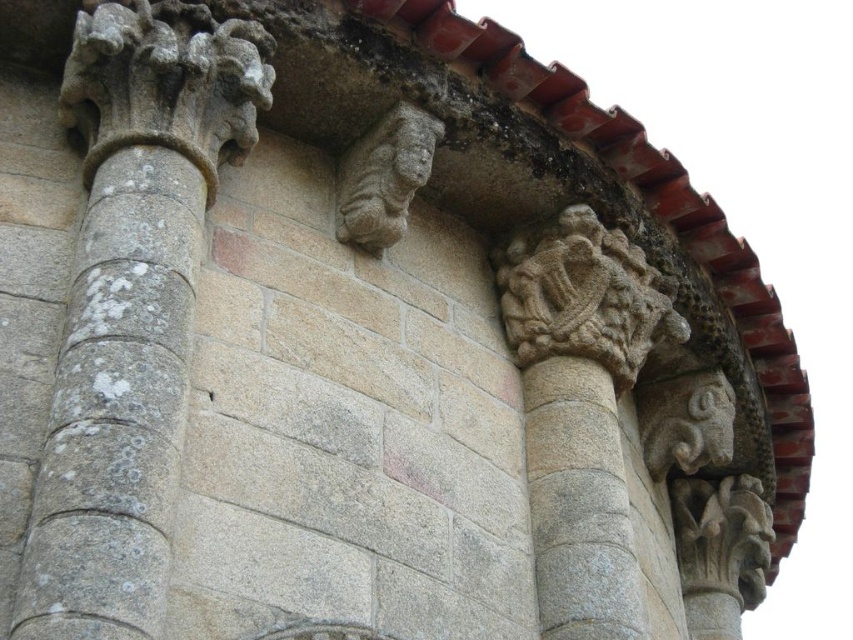
You are an architect examining this historical structure. You notice two carvings above the columns. The carved stone lion at center and the smooth stone face at center. Which of these two carvings is placed higher up on the wall?

The smooth stone face at center is placed higher up because the carved stone lion at center is positioned under it.

You are an architect examining the stone structure. You notice the gray stone column at center and the carved stone sculpture at upper center. Which object is closer to you from your viewing position?

The gray stone column at center is closer to you than the carved stone sculpture at upper center because it is positioned in front of it.

You are an architect examining the stone structure. You notice two carvings at the center of the wall, the carved stone lion at center and the smooth stone face at center. Which one is taller?

The carved stone lion at center is taller than the smooth stone face at center.